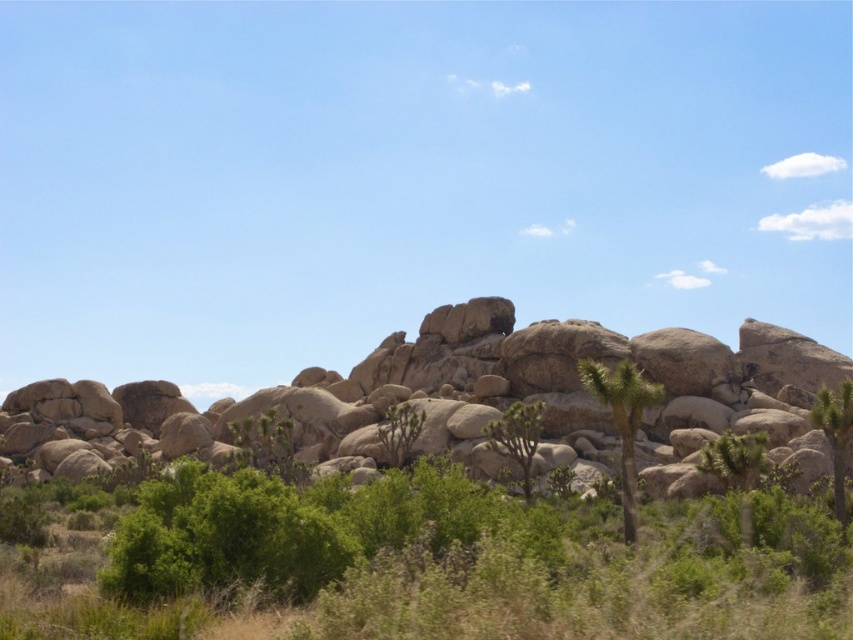
Is point (614, 392) closer to camera compared to point (834, 486)?

Yes.

Does green spiky tree at center have a lesser width compared to green leafy tree at right?

Correct, green spiky tree at center's width is less than green leafy tree at right's.

Measure the distance between point (627, 513) and camera.

The distance of point (627, 513) from camera is 70.50 meters.

I want to click on green spiky tree at center, so click(x=622, y=419).

Who is taller, green spiky tree at center or green spiky cactus at center-right?

Standing taller between the two is green spiky tree at center.

Which of these two, green spiky tree at center or green spiky cactus at center-right, stands shorter?

Standing shorter between the two is green spiky cactus at center-right.

Which is behind, point (610, 376) or point (759, 436)?

The point (759, 436) is more distant.

Image resolution: width=853 pixels, height=640 pixels. I want to click on green spiky tree at center, so click(x=622, y=419).

Is point (749, 454) in front of point (527, 488)?

That is True.

Which is behind, point (726, 480) or point (527, 442)?

Positioned behind is point (527, 442).

This screenshot has height=640, width=853. Describe the element at coordinates (737, 470) in the screenshot. I see `green spiky cactus at center-right` at that location.

The height and width of the screenshot is (640, 853). Find the location of `green spiky cactus at center-right`. green spiky cactus at center-right is located at coordinates (737, 470).